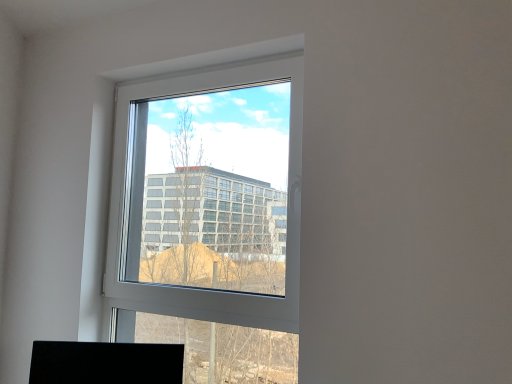
Question: Should I look upward or downward to see black matte desktop at lower left?

Choices:
 (A) up
 (B) down

Answer: (B)

Question: Does black matte desktop at lower left have a lesser width compared to white plastic window at center?

Choices:
 (A) yes
 (B) no

Answer: (B)

Question: Does black matte desktop at lower left come in front of white plastic window at center?

Choices:
 (A) no
 (B) yes

Answer: (A)

Question: Considering the relative sizes of black matte desktop at lower left and white plastic window at center in the image provided, is black matte desktop at lower left shorter than white plastic window at center?

Choices:
 (A) no
 (B) yes

Answer: (B)

Question: Is white plastic window at center at the back of black matte desktop at lower left?

Choices:
 (A) no
 (B) yes

Answer: (B)

Question: Is black matte desktop at lower left far away from white plastic window at center?

Choices:
 (A) no
 (B) yes

Answer: (A)

Question: Does black matte desktop at lower left appear on the right side of white plastic window at center?

Choices:
 (A) yes
 (B) no

Answer: (B)

Question: From the image's perspective, is white plastic window at center beneath black matte desktop at lower left?

Choices:
 (A) yes
 (B) no

Answer: (B)

Question: From the image's perspective, does white plastic window at center appear higher than black matte desktop at lower left?

Choices:
 (A) no
 (B) yes

Answer: (B)

Question: Is white plastic window at center aimed at black matte desktop at lower left?

Choices:
 (A) yes
 (B) no

Answer: (A)

Question: Is white plastic window at center not close to black matte desktop at lower left?

Choices:
 (A) no
 (B) yes

Answer: (A)

Question: Considering the relative positions of white plastic window at center and black matte desktop at lower left in the image provided, is white plastic window at center in front of black matte desktop at lower left?

Choices:
 (A) no
 (B) yes

Answer: (B)

Question: Considering the relative positions of white plastic window at center and black matte desktop at lower left in the image provided, is white plastic window at center to the right of black matte desktop at lower left from the viewer's perspective?

Choices:
 (A) no
 (B) yes

Answer: (B)

Question: Considering the positions of point (157, 258) and point (34, 367), is point (157, 258) closer or farther from the camera than point (34, 367)?

Choices:
 (A) farther
 (B) closer

Answer: (A)